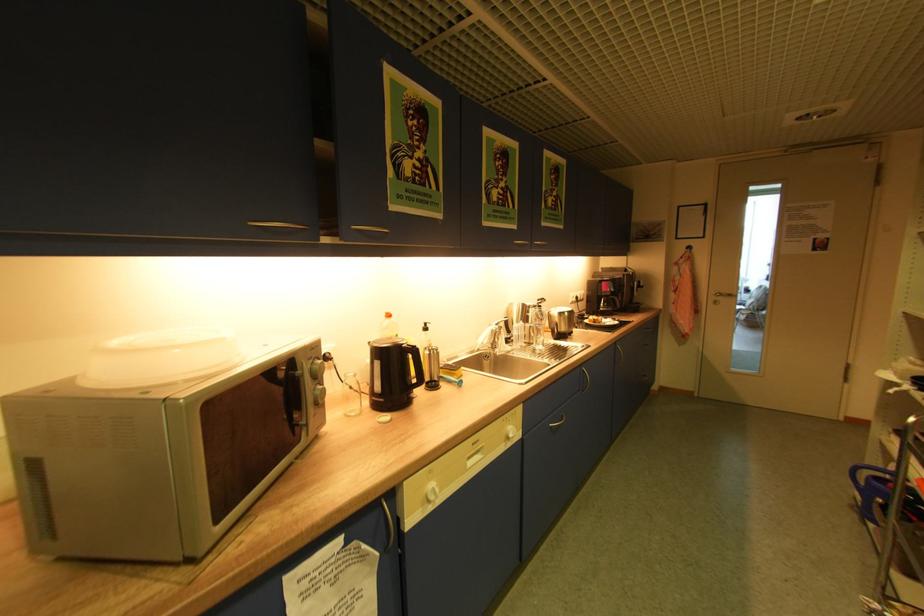
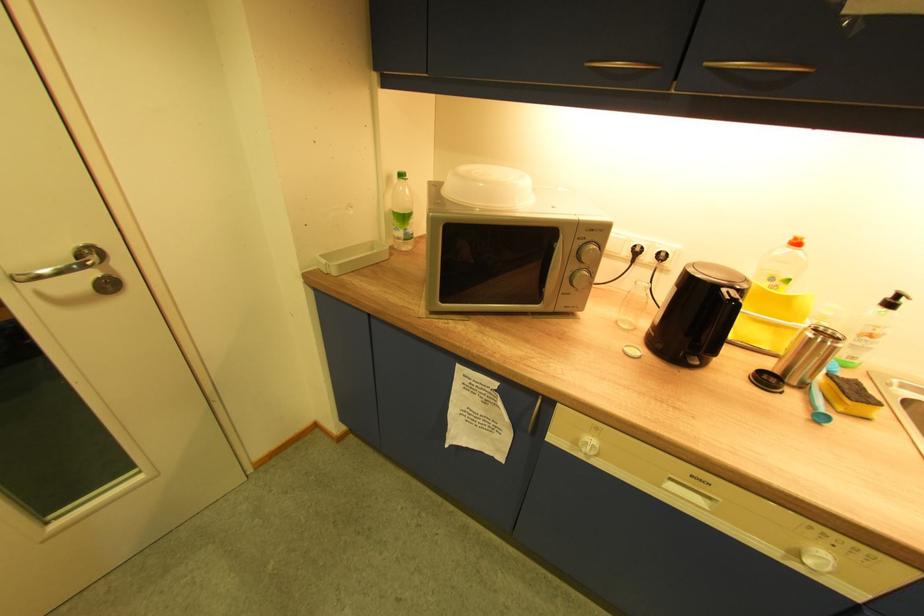
Locate, in the second image, the point that corresponds to point (317, 363) in the first image.

(589, 243)